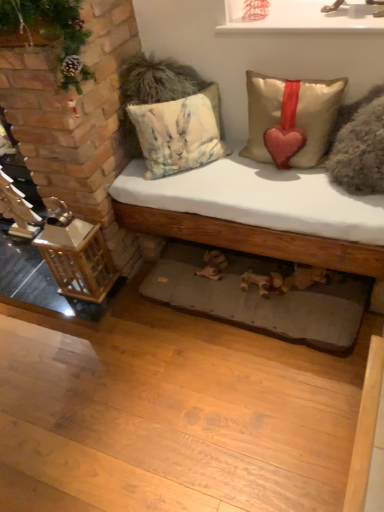
Question: In terms of width, does white glossy shelf at upper center look wider or thinner when compared to wooden lantern at left?

Choices:
 (A) thin
 (B) wide

Answer: (B)

Question: From a real-world perspective, relative to wooden lantern at left, is white glossy shelf at upper center vertically above or below?

Choices:
 (A) above
 (B) below

Answer: (A)

Question: Considering the real-world distances, which object is farthest from the white glossy shelf at upper center?

Choices:
 (A) gray fabric mat at lower center
 (B) white cotton bed at center
 (C) satin beige cushion at right, the first pillow positioned from the right
 (D) wooden lantern at left
 (E) satin gold pillow with red heart at upper center, the second pillow from the right

Answer: (D)

Question: Which of these objects is positioned closest to the wooden lantern at left?

Choices:
 (A) satin gold pillow with red heart at upper center, the second pillow from the right
 (B) white cotton bed at center
 (C) white glossy shelf at upper center
 (D) gray fabric mat at lower center
 (E) satin beige cushion at right, the first pillow positioned from the right

Answer: (B)